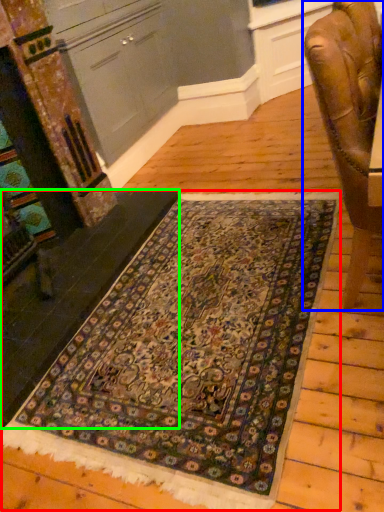
Question: Which object is the farthest from mat (highlighted by a red box)? Choose among these: chair (highlighted by a blue box) or stair (highlighted by a green box).

Choices:
 (A) chair
 (B) stair

Answer: (A)